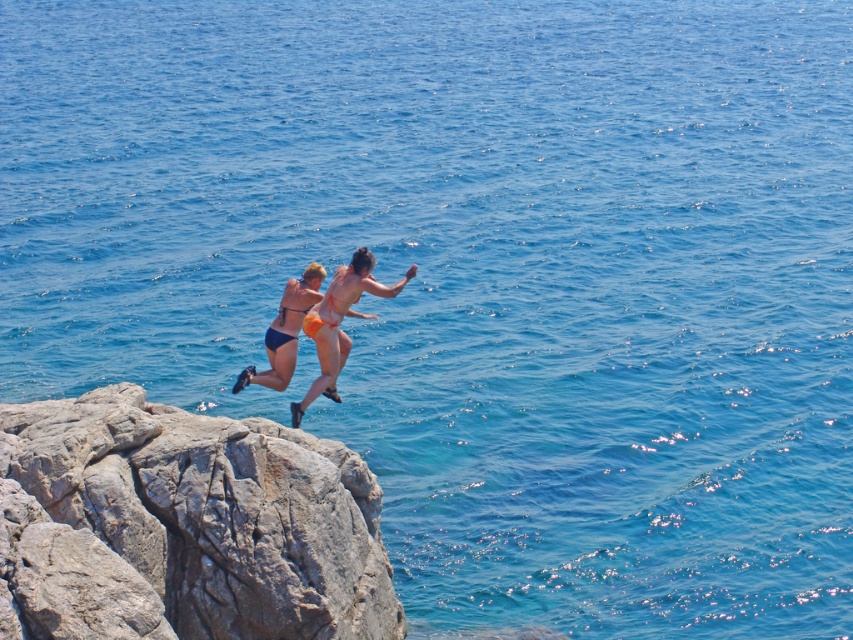
Question: Which of these objects is positioned farthest from the orange bikini at center?

Choices:
 (A) gray rough rock at left
 (B) matte blue bikini at center

Answer: (A)

Question: From the image, what is the correct spatial relationship of orange bikini at center in relation to matte blue bikini at center?

Choices:
 (A) right
 (B) left

Answer: (A)

Question: Where is gray rough rock at left located in relation to matte blue bikini at center in the image?

Choices:
 (A) right
 (B) left

Answer: (B)

Question: Is gray rough rock at left to the left of orange bikini at center from the viewer's perspective?

Choices:
 (A) no
 (B) yes

Answer: (B)

Question: Considering the real-world distances, which object is closest to the gray rough rock at left?

Choices:
 (A) orange bikini at center
 (B) matte blue bikini at center

Answer: (B)

Question: Which object appears farthest from the camera in this image?

Choices:
 (A) matte blue bikini at center
 (B) orange bikini at center

Answer: (B)